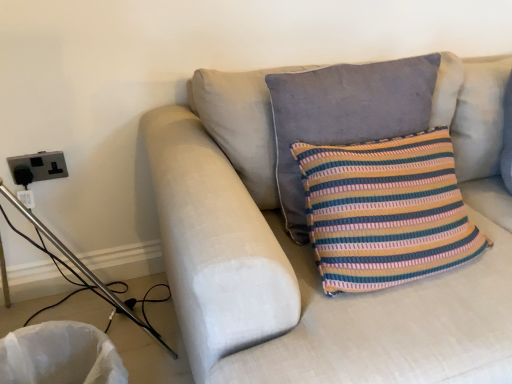
Where is `light beige fabric couch at center`? light beige fabric couch at center is located at coordinates (291, 265).

The image size is (512, 384). I want to click on striped fabric pillow at center, positioned as the first pillow in left-to-right order, so click(345, 115).

The width and height of the screenshot is (512, 384). In order to click on light beige fabric couch at center in this screenshot , I will do `click(291, 265)`.

Measure the distance from light beige fabric couch at center to black plastic outlet at left.

light beige fabric couch at center and black plastic outlet at left are 79.43 centimeters apart from each other.

Does light beige fabric couch at center touch black plastic outlet at left?

No, light beige fabric couch at center is not next to black plastic outlet at left.

Is point (190, 352) positioned before point (45, 152)?

Yes, point (190, 352) is closer to viewer.

Looking at this image, from the image's perspective, is light beige fabric couch at center under black plastic outlet at left?

Indeed, from the image's perspective, light beige fabric couch at center is shown beneath black plastic outlet at left.

Is striped fabric cushion at upper right, positioned as the 1th pillow in right-to-left order, to the right of light beige fabric couch at center from the viewer's perspective?

Indeed, striped fabric cushion at upper right, positioned as the 1th pillow in right-to-left order, is positioned on the right side of light beige fabric couch at center.

From the picture: Which is more distant, (461, 98) or (286, 287)?

The point (461, 98) is farther.

Which object is further away from the camera, striped fabric cushion at upper right, marked as the second pillow in a left-to-right arrangement, or light beige fabric couch at center?

striped fabric cushion at upper right, marked as the second pillow in a left-to-right arrangement, is behind.

Is striped fabric pillow at center, positioned as the first pillow in left-to-right order, positioned behind light beige fabric couch at center?

Yes, striped fabric pillow at center, positioned as the first pillow in left-to-right order, is further from the viewer.

Can you tell me how much striped fabric pillow at center, positioned as the first pillow in left-to-right order, and light beige fabric couch at center differ in facing direction?

The facing directions of striped fabric pillow at center, positioned as the first pillow in left-to-right order, and light beige fabric couch at center are 0.00141 degrees apart.

From the image's perspective, starting from the light beige fabric couch at center, which pillow is the 1st one above? Please provide its 2D coordinates.

[(345, 115)]

From the image's perspective, does striped fabric pillow at center, marked as the second pillow in a right-to-left arrangement, appear lower than light beige fabric couch at center?

No, from the image's perspective, striped fabric pillow at center, marked as the second pillow in a right-to-left arrangement, is not below light beige fabric couch at center.

Considering the sizes of objects striped fabric pillow at center, positioned as the first pillow in left-to-right order, and striped fabric cushion at upper right, marked as the second pillow in a left-to-right arrangement, in the image provided, who is bigger, striped fabric pillow at center, positioned as the first pillow in left-to-right order, or striped fabric cushion at upper right, marked as the second pillow in a left-to-right arrangement,?

Bigger between the two is striped fabric pillow at center, positioned as the first pillow in left-to-right order.

Does point (378, 123) appear closer or farther from the camera than point (466, 141)?

Point (378, 123).

Is striped fabric pillow at center, marked as the second pillow in a right-to-left arrangement, oriented away from striped fabric cushion at upper right, marked as the second pillow in a left-to-right arrangement?

No.

Which is more to the right, black plastic outlet at left or striped fabric cushion at upper right, positioned as the 1th pillow in right-to-left order?

Positioned to the right is striped fabric cushion at upper right, positioned as the 1th pillow in right-to-left order.

Does black plastic outlet at left have a smaller size compared to striped fabric cushion at upper right, marked as the second pillow in a left-to-right arrangement?

Yes, black plastic outlet at left is smaller than striped fabric cushion at upper right, marked as the second pillow in a left-to-right arrangement.

Is black plastic outlet at left taller or shorter than striped fabric cushion at upper right, marked as the second pillow in a left-to-right arrangement?

Considering their sizes, black plastic outlet at left has less height than striped fabric cushion at upper right, marked as the second pillow in a left-to-right arrangement.

Is point (250, 111) farther from viewer compared to point (328, 71)?

No, (250, 111) is in front of (328, 71).

Is striped fabric pillow at center, marked as the second pillow in a right-to-left arrangement, a part of light beige fabric couch at center?

Yes, light beige fabric couch at center is surrounding striped fabric pillow at center, marked as the second pillow in a right-to-left arrangement.

Between light beige fabric couch at center and striped fabric pillow at center, positioned as the first pillow in left-to-right order, which one has more height?

light beige fabric couch at center.

Considering the sizes of light beige fabric couch at center and striped fabric cushion at upper right, positioned as the 1th pillow in right-to-left order, in the image, is light beige fabric couch at center taller or shorter than striped fabric cushion at upper right, positioned as the 1th pillow in right-to-left order,?

Considering their sizes, light beige fabric couch at center has more height than striped fabric cushion at upper right, positioned as the 1th pillow in right-to-left order.

Does light beige fabric couch at center have a smaller size compared to striped fabric cushion at upper right, marked as the second pillow in a left-to-right arrangement?

No.

Considering the positions of objects light beige fabric couch at center and striped fabric cushion at upper right, marked as the second pillow in a left-to-right arrangement, in the image provided, who is more to the left, light beige fabric couch at center or striped fabric cushion at upper right, marked as the second pillow in a left-to-right arrangement,?

Positioned to the left is light beige fabric couch at center.

From a real-world perspective, is light beige fabric couch at center on top of striped fabric cushion at upper right, positioned as the 1th pillow in right-to-left order?

No, from a real-world perspective, light beige fabric couch at center is not on top of striped fabric cushion at upper right, positioned as the 1th pillow in right-to-left order.

What are the coordinates of `electric outlet on the left side of light beige fabric couch at center` in the screenshot? It's located at (37, 167).

Identify the location of the 2nd pillow above when counting from the light beige fabric couch at center (from the image's perspective). (480, 117).

Considering their positions, is black plastic outlet at left positioned closer to light beige fabric couch at center than striped fabric cushion at upper right, marked as the second pillow in a left-to-right arrangement?

striped fabric cushion at upper right, marked as the second pillow in a left-to-right arrangement, lies closer to light beige fabric couch at center than the other object.

Which object lies further to the anchor point striped fabric pillow at center, positioned as the first pillow in left-to-right order, light beige fabric couch at center or striped fabric cushion at upper right, positioned as the 1th pillow in right-to-left order?

Among the two, striped fabric cushion at upper right, positioned as the 1th pillow in right-to-left order, is located further to striped fabric pillow at center, positioned as the first pillow in left-to-right order.

Estimate the real-world distances between objects in this image. Which object is closer to light beige fabric couch at center, striped fabric pillow at center, marked as the second pillow in a right-to-left arrangement, or striped fabric cushion at upper right, positioned as the 1th pillow in right-to-left order?

Among the two, striped fabric pillow at center, marked as the second pillow in a right-to-left arrangement, is located nearer to light beige fabric couch at center.

Considering their positions, is black plastic outlet at left positioned closer to striped fabric cushion at upper right, positioned as the 1th pillow in right-to-left order, than light beige fabric couch at center?

Among the two, light beige fabric couch at center is located nearer to striped fabric cushion at upper right, positioned as the 1th pillow in right-to-left order.

From the image, which object appears to be nearer to striped fabric pillow at center, marked as the second pillow in a right-to-left arrangement, black plastic outlet at left or light beige fabric couch at center?

light beige fabric couch at center is closer to striped fabric pillow at center, marked as the second pillow in a right-to-left arrangement.

Looking at the image, which one is located further to light beige fabric couch at center, black plastic outlet at left or striped fabric pillow at center, marked as the second pillow in a right-to-left arrangement?

black plastic outlet at left lies further to light beige fabric couch at center than the other object.

When comparing their distances from striped fabric cushion at upper right, marked as the second pillow in a left-to-right arrangement, does light beige fabric couch at center or black plastic outlet at left seem closer?

light beige fabric couch at center.

Based on their spatial positions, is striped fabric cushion at upper right, marked as the second pillow in a left-to-right arrangement, or light beige fabric couch at center closer to striped fabric pillow at center, positioned as the first pillow in left-to-right order?

Among the two, light beige fabric couch at center is located nearer to striped fabric pillow at center, positioned as the first pillow in left-to-right order.

I want to click on pillow positioned between light beige fabric couch at center and striped fabric cushion at upper right, marked as the second pillow in a left-to-right arrangement, from near to far, so click(345, 115).

Find the location of `pillow situated between black plastic outlet at left and light beige fabric couch at center from left to right`. pillow situated between black plastic outlet at left and light beige fabric couch at center from left to right is located at coordinates (345, 115).

You are a GUI agent. You are given a task and a screenshot of the screen. Output one action in this format:
    pyautogui.click(x=<x>, y=<y>)
    Task: Click on the pillow located between black plastic outlet at left and striped fabric cushion at upper right, positioned as the 1th pillow in right-to-left order, in the left-right direction
    
    Given the screenshot: What is the action you would take?
    pyautogui.click(x=345, y=115)

Image resolution: width=512 pixels, height=384 pixels. I want to click on studio couch between black plastic outlet at left and striped fabric cushion at upper right, marked as the second pillow in a left-to-right arrangement, so click(x=291, y=265).